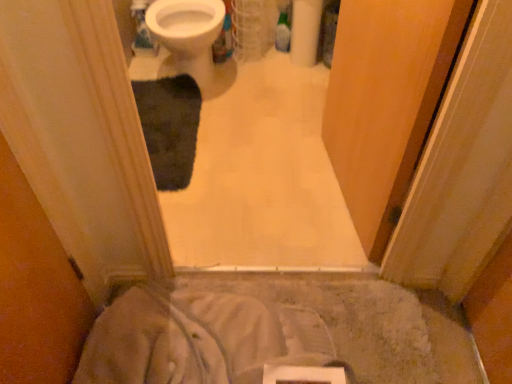
Locate an element on the screen. This screenshot has width=512, height=384. free space between wooden screen door at center and dark gray plush bath mat at center is located at coordinates (254, 172).